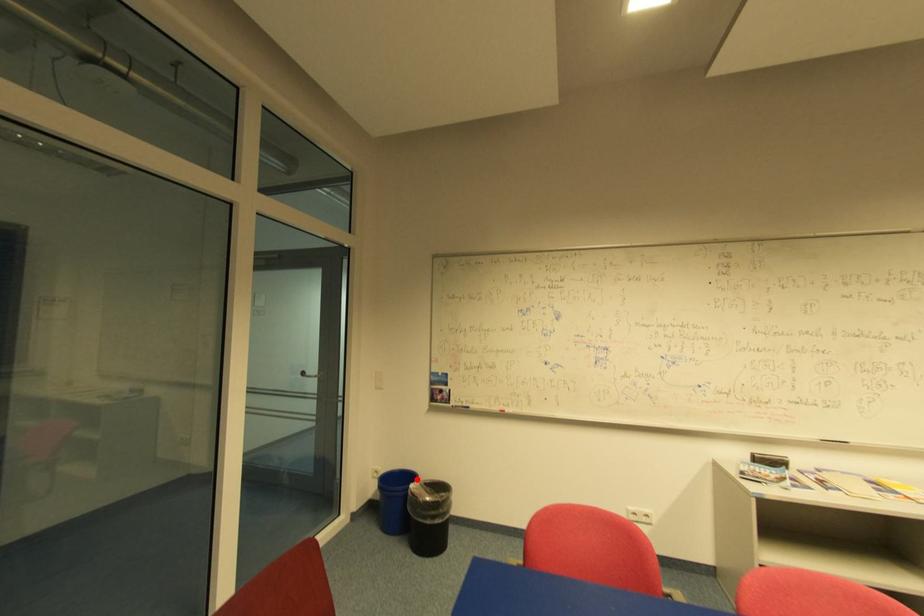
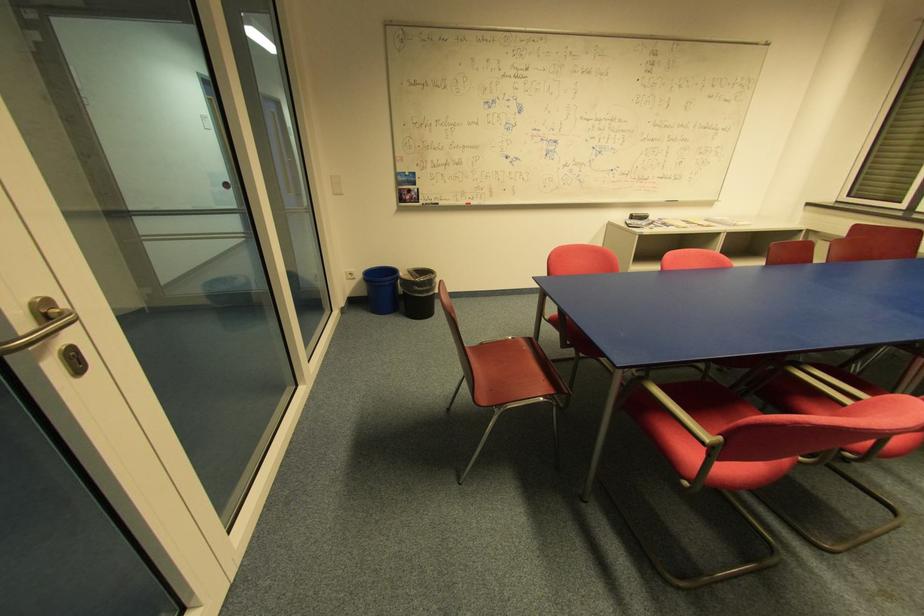
Question: A red point is marked in image1. In image2, is the corresponding 3D point closer to the camera or farther? Reply with the corresponding letter.

Choices:
 (A) The corresponding 3D point is closer.
 (B) The corresponding 3D point is farther.

Answer: (A)